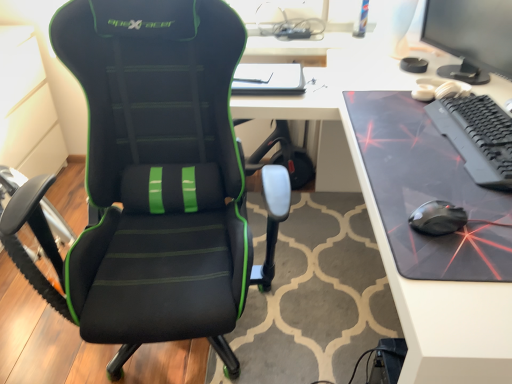
Question: Are black matte keyboard at right and matte black monitor at upper right far apart?

Choices:
 (A) yes
 (B) no

Answer: (B)

Question: Is black matte keyboard at right shorter than matte black monitor at upper right?

Choices:
 (A) no
 (B) yes

Answer: (B)

Question: From the image's perspective, does black matte keyboard at right appear higher than matte black monitor at upper right?

Choices:
 (A) yes
 (B) no

Answer: (B)

Question: From a real-world perspective, is black matte keyboard at right located higher than matte black monitor at upper right?

Choices:
 (A) no
 (B) yes

Answer: (A)

Question: Is black matte keyboard at right to the right of matte black monitor at upper right from the viewer's perspective?

Choices:
 (A) yes
 (B) no

Answer: (B)

Question: Considering the relative positions of black matte keyboard at right and matte black monitor at upper right in the image provided, is black matte keyboard at right in front of matte black monitor at upper right?

Choices:
 (A) yes
 (B) no

Answer: (A)

Question: Does black leather chair at left appear on the left side of matte black monitor at upper right?

Choices:
 (A) no
 (B) yes

Answer: (B)

Question: From a real-world perspective, is black leather chair at left located beneath matte black monitor at upper right?

Choices:
 (A) no
 (B) yes

Answer: (B)

Question: Is black leather chair at left not inside matte black monitor at upper right?

Choices:
 (A) no
 (B) yes

Answer: (B)

Question: Does black leather chair at left have a lesser width compared to matte black monitor at upper right?

Choices:
 (A) no
 (B) yes

Answer: (A)

Question: Is black leather chair at left at the right side of matte black monitor at upper right?

Choices:
 (A) no
 (B) yes

Answer: (A)

Question: From a real-world perspective, is black leather chair at left positioned over matte black monitor at upper right based on gravity?

Choices:
 (A) no
 (B) yes

Answer: (A)

Question: Can you confirm if black matte keyboard at right is positioned to the left of black glossy mouse at right?

Choices:
 (A) no
 (B) yes

Answer: (A)